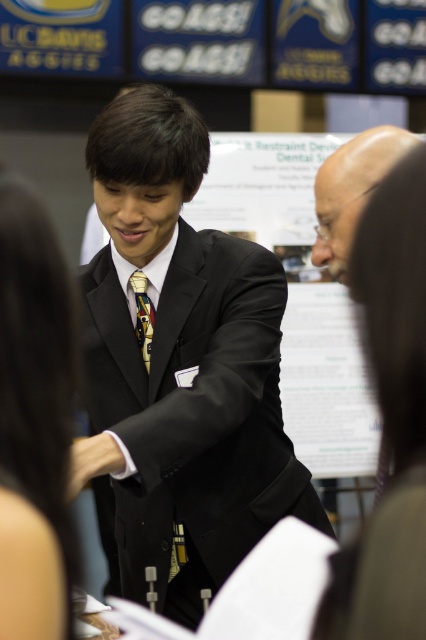
Is black matte suit at center thinner than yellow silk tie at center?

No, black matte suit at center is not thinner than yellow silk tie at center.

Who is positioned more to the left, black matte suit at center or yellow silk tie at center?

Positioned to the left is yellow silk tie at center.

The image size is (426, 640). I want to click on black matte suit at center, so click(x=180, y=369).

Is black matte suit at center positioned at the back of smooth brown hair at upper right?

Yes, black matte suit at center is further from the viewer.

Does black matte suit at center appear on the right side of smooth brown hair at upper right?

In fact, black matte suit at center is to the left of smooth brown hair at upper right.

Find the location of a particular element. The height and width of the screenshot is (640, 426). black matte suit at center is located at coordinates (180, 369).

Between smooth black hair at center and bald head at upper right, which one is positioned lower?

Positioned lower is smooth black hair at center.

Between point (65, 536) and point (330, 260), which one is positioned behind?

Positioned behind is point (330, 260).

At what (x,y) coordinates should I click in order to perform the action: click on smooth black hair at center. Please return your answer as a coordinate pair (x, y). Image resolution: width=426 pixels, height=640 pixels. Looking at the image, I should click on (36, 369).